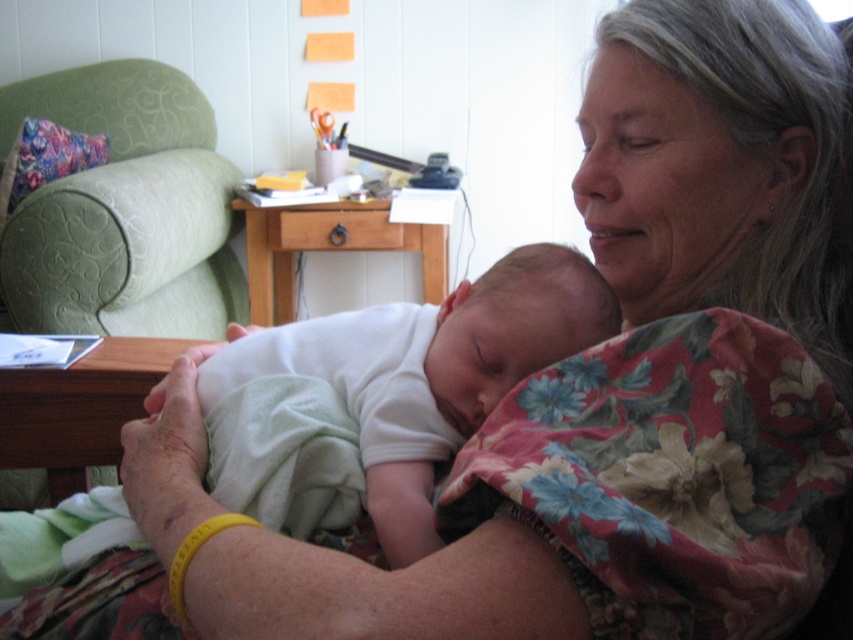
Question: Which point appears closest to the camera in this image?

Choices:
 (A) (294, 348)
 (B) (80, 323)

Answer: (A)

Question: Is green fabric armchair at left positioned behind white soft fabric newborn at center?

Choices:
 (A) no
 (B) yes

Answer: (B)

Question: Is green fabric armchair at left bigger than white soft fabric newborn at center?

Choices:
 (A) yes
 (B) no

Answer: (A)

Question: Does green fabric armchair at left have a lesser width compared to white soft fabric newborn at center?

Choices:
 (A) no
 (B) yes

Answer: (A)

Question: Among these objects, which one is nearest to the camera?

Choices:
 (A) white soft fabric newborn at center
 (B) green fabric armchair at left

Answer: (A)